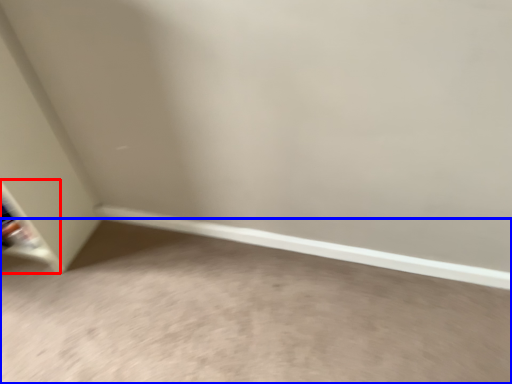
Question: Among these objects, which one is nearest to the camera, shelf (highlighted by a red box) or concrete (highlighted by a blue box)?

Choices:
 (A) shelf
 (B) concrete

Answer: (B)